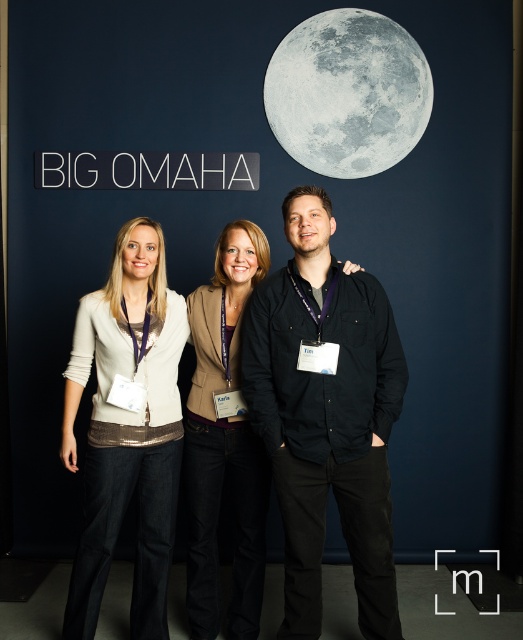
Question: Which object is positioned farthest from the gray matte moon at upper center?

Choices:
 (A) black cotton shirt at center
 (B) matte brown blazer at center

Answer: (A)

Question: Which point is closer to the camera?

Choices:
 (A) (373, 628)
 (B) (77, 321)
 (C) (338, 61)
 (D) (210, 387)

Answer: (A)

Question: Does black cotton shirt at center have a lesser width compared to gray matte moon at upper center?

Choices:
 (A) yes
 (B) no

Answer: (A)

Question: From the image, what is the correct spatial relationship of matte white sweater at center in relation to matte brown blazer at center?

Choices:
 (A) left
 (B) right

Answer: (A)

Question: Considering the relative positions of black cotton shirt at center and matte brown blazer at center in the image provided, where is black cotton shirt at center located with respect to matte brown blazer at center?

Choices:
 (A) left
 (B) right

Answer: (B)

Question: Which object appears farthest from the camera in this image?

Choices:
 (A) matte white sweater at center
 (B) black cotton shirt at center
 (C) matte brown blazer at center

Answer: (C)